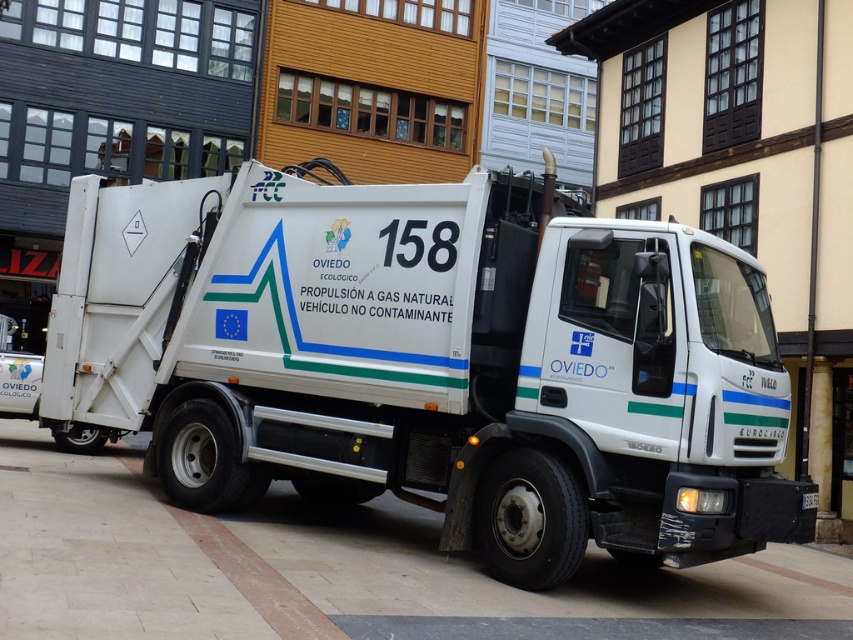
You are a pedestrian standing on the sidewalk and want to cross the street to reach the buildings behind the white matte truck at center. Since the truck is blocking the path, can you go around it using the white tile pavement at center? Explain why or why not based on their sizes.

The white matte truck at center is shorter than white tile pavement at center, so yes, you can go around the truck using the white tile pavement at center because the pavement is longer and provides enough space to bypass the truck.

Based on the photo, you are a delivery person with a cart that is 3 meters wide. You need to move your cart between the white matte truck at center and the white tile pavement at center. Is there enough space for your cart to fit through the gap between them?

The white matte truck at center and white tile pavement at center are 2.71 meters apart from each other. Since the cart is 3 meters wide, it is wider than the gap, so the cart cannot fit through the space between them.